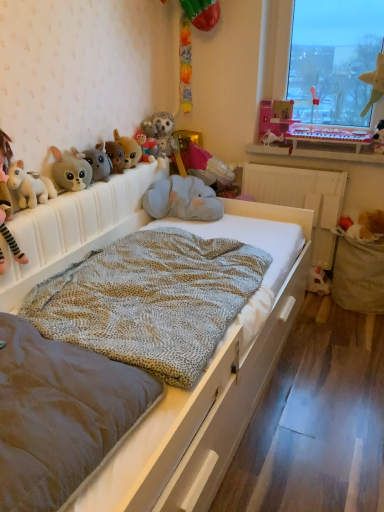
What are the coordinates of `vacant region to the right of white plush toy at upper center, which is the ninth toy in left-to-right order` in the screenshot? It's located at (295, 146).